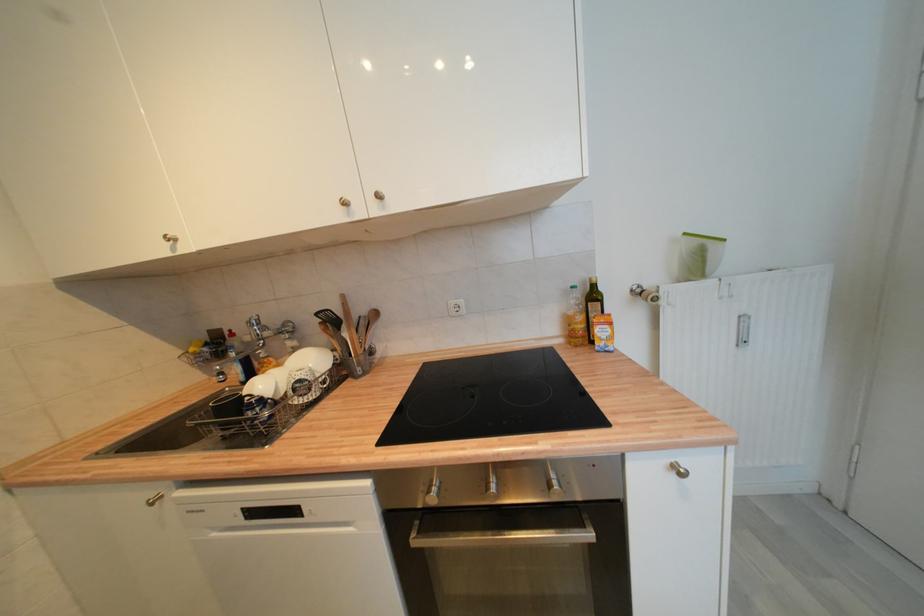
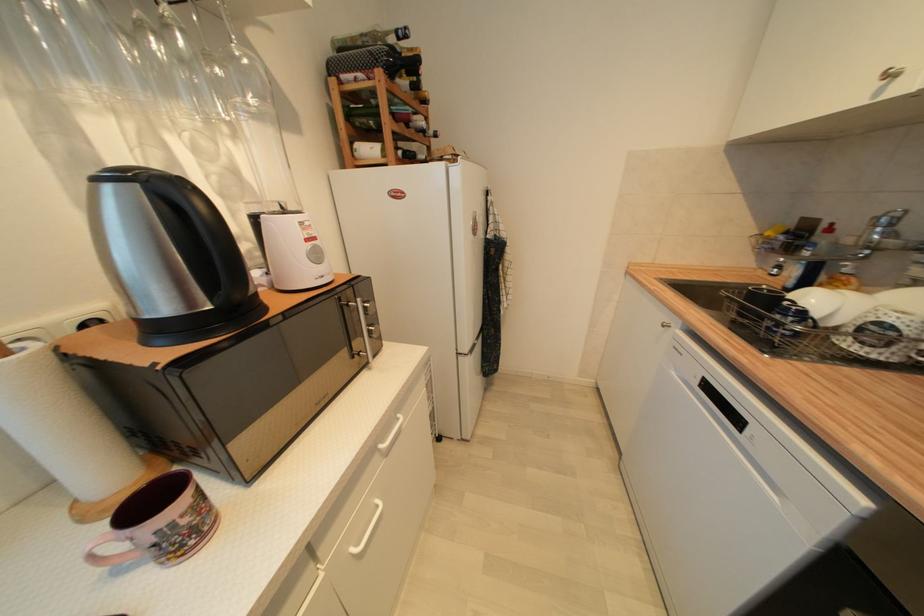
Based on the continuous images, in which direction is the camera rotating?

The camera's rotation is toward left-down.